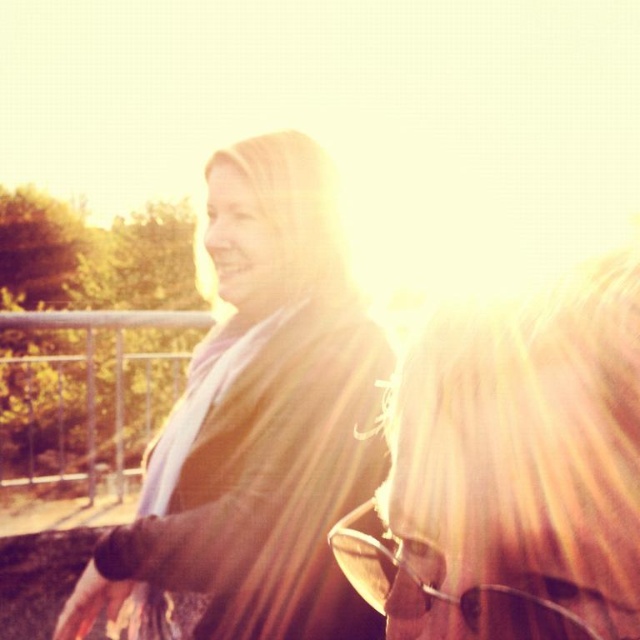
Question: Which point is farther to the camera?

Choices:
 (A) blonde hair at upper right
 (B) sunglasses at center
 (C) matte black jacket at center

Answer: (C)

Question: Is matte black jacket at center bigger than blonde hair at upper right?

Choices:
 (A) no
 (B) yes

Answer: (B)

Question: Is matte black jacket at center closer to the viewer compared to sunglasses at center?

Choices:
 (A) no
 (B) yes

Answer: (A)

Question: Which point is farther from the camera taking this photo?

Choices:
 (A) (353, 547)
 (B) (164, 499)
 (C) (538, 532)

Answer: (B)

Question: Is blonde hair at upper right smaller than sunglasses at center?

Choices:
 (A) no
 (B) yes

Answer: (A)

Question: Which of the following is the closest to the observer?

Choices:
 (A) sunglasses at center
 (B) matte black jacket at center

Answer: (A)